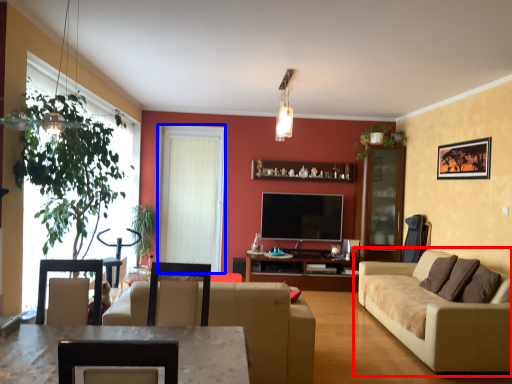
Question: Which of the following is the farthest to the observer, studio couch (highlighted by a red box) or window screen (highlighted by a blue box)?

Choices:
 (A) studio couch
 (B) window screen

Answer: (B)